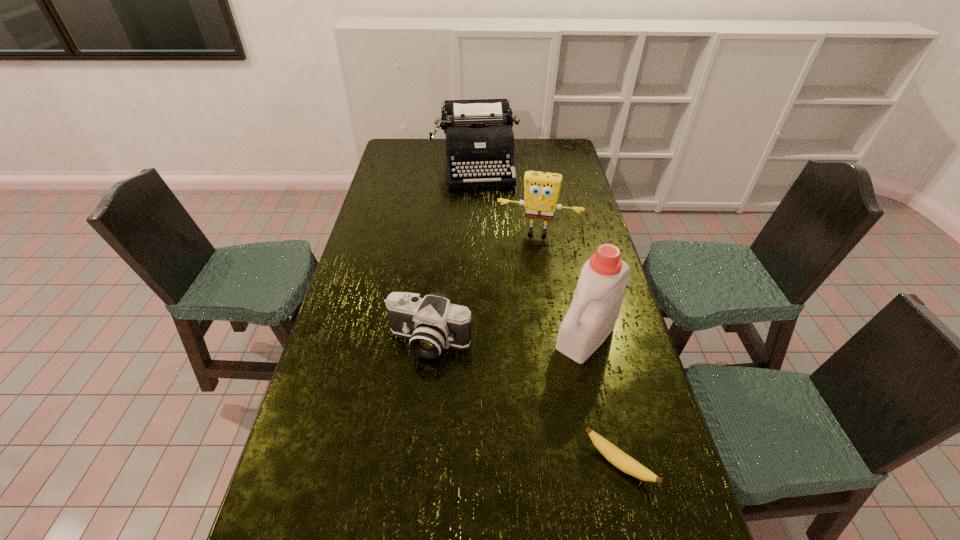
Where is `sponge that is at the right edge`? The width and height of the screenshot is (960, 540). sponge that is at the right edge is located at coordinates (541, 189).

At what (x,y) coordinates should I click in order to perform the action: click on detergent situated at the right edge. Please return your answer as a coordinate pair (x, y). This screenshot has width=960, height=540. Looking at the image, I should click on (591, 317).

You are a GUI agent. You are given a task and a screenshot of the screen. Output one action in this format:
    pyautogui.click(x=<x>, y=<y>)
    Task: Click on the object located at the near right corner
    
    Given the screenshot: What is the action you would take?
    pyautogui.click(x=613, y=454)

In the image, there is a desktop. Identify the location of free region at the far edge. The image size is (960, 540). (521, 158).

You are a GUI agent. You are given a task and a screenshot of the screen. Output one action in this format:
    pyautogui.click(x=<x>, y=<y>)
    Task: Click on the vacant space at the near edge of the desktop
    The height and width of the screenshot is (540, 960).
    Given the screenshot: What is the action you would take?
    pyautogui.click(x=404, y=489)

The image size is (960, 540). In order to click on vacant space at the left edge of the desktop in this screenshot , I will do `click(394, 195)`.

Find the location of a particular element. The image size is (960, 540). blank space at the right edge is located at coordinates (593, 242).

At what (x,y) coordinates should I click in order to perform the action: click on free spot at the near left corner of the desktop. Please return your answer as a coordinate pair (x, y). Looking at the image, I should click on (328, 496).

In the image, there is a desktop. Where is `vacant space at the far right corner`? vacant space at the far right corner is located at coordinates (544, 146).

You are a GUI agent. You are given a task and a screenshot of the screen. Output one action in this format:
    pyautogui.click(x=<x>, y=<y>)
    Task: Click on the empty space between the second shortest object and the sponge
    The width and height of the screenshot is (960, 540).
    Given the screenshot: What is the action you would take?
    pyautogui.click(x=484, y=287)